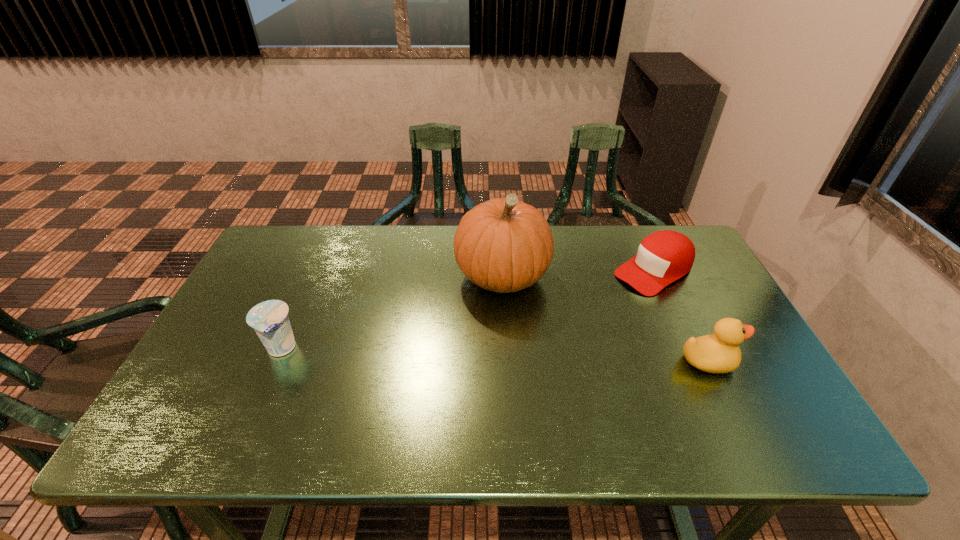
Locate an element on the screen. The height and width of the screenshot is (540, 960). the leftmost object is located at coordinates (269, 319).

Locate an element on the screen. Image resolution: width=960 pixels, height=540 pixels. the second tallest object is located at coordinates (717, 353).

At what (x,y) coordinates should I click in order to perform the action: click on the tallest object. Please return your answer as a coordinate pair (x, y). The width and height of the screenshot is (960, 540). Looking at the image, I should click on (504, 245).

Find the location of a particular element. This screenshot has height=540, width=960. the third object from right to left is located at coordinates (504, 245).

The image size is (960, 540). I want to click on baseball cap, so click(663, 257).

At what (x,y) coordinates should I click in order to perform the action: click on free space located 0.060m on the left of the yogurt. Please return your answer as a coordinate pair (x, y). This screenshot has width=960, height=540. Looking at the image, I should click on (238, 349).

Where is `free location located on the stem of the third object from right to left`? The width and height of the screenshot is (960, 540). free location located on the stem of the third object from right to left is located at coordinates (462, 325).

The image size is (960, 540). What are the coordinates of `vacant space situated on the stem of the third object from right to left` in the screenshot? It's located at coord(446,346).

I want to click on vacant space located 0.220m on the stem of the third object from right to left, so click(435, 359).

You are a GUI agent. You are given a task and a screenshot of the screen. Output one action in this format:
    pyautogui.click(x=<x>, y=<y>)
    Task: Click on the vacant area situated on the front-facing side of the baseball cap
    This screenshot has height=540, width=960.
    Given the screenshot: What is the action you would take?
    pyautogui.click(x=565, y=323)